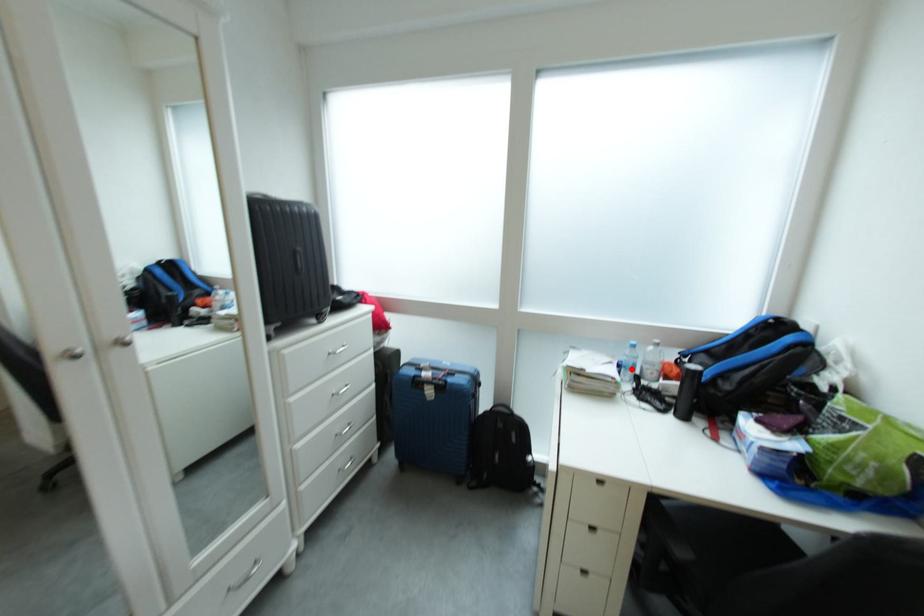
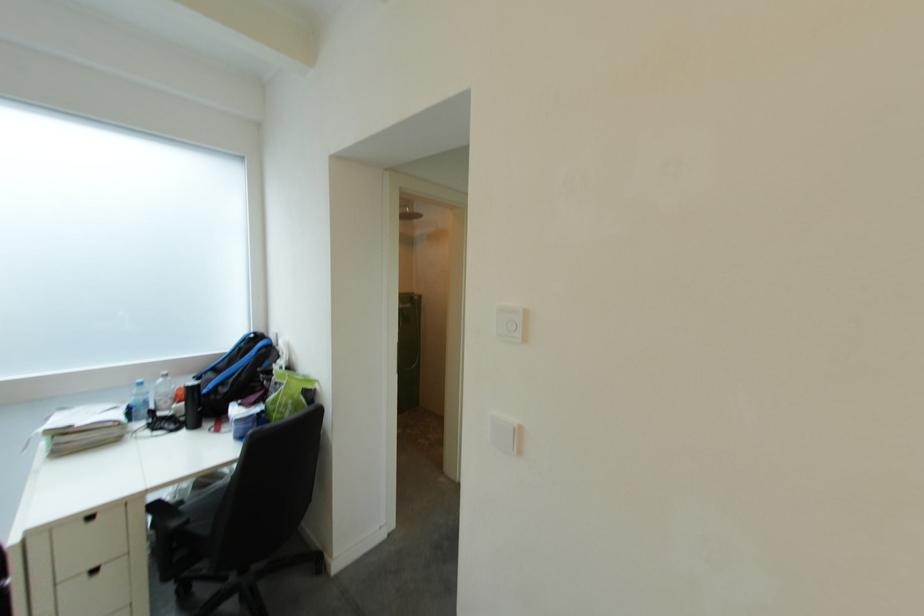
Where in the second image is the point corresponding to the highlighted location from the first image?

(141, 411)